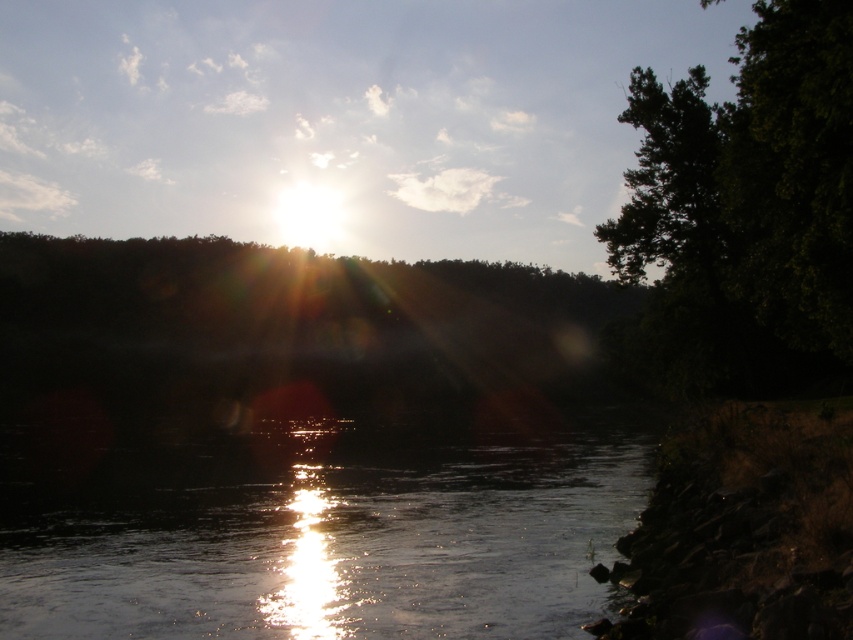
Is glistening water at center taller than green leafy tree at right?

In fact, glistening water at center may be shorter than green leafy tree at right.

Measure the distance between point (338, 577) and camera.

15.67 meters

Between point (65, 420) and point (694, 234), which one is positioned behind?

Positioned behind is point (65, 420).

Where is `glistening water at center`? This screenshot has height=640, width=853. glistening water at center is located at coordinates (315, 524).